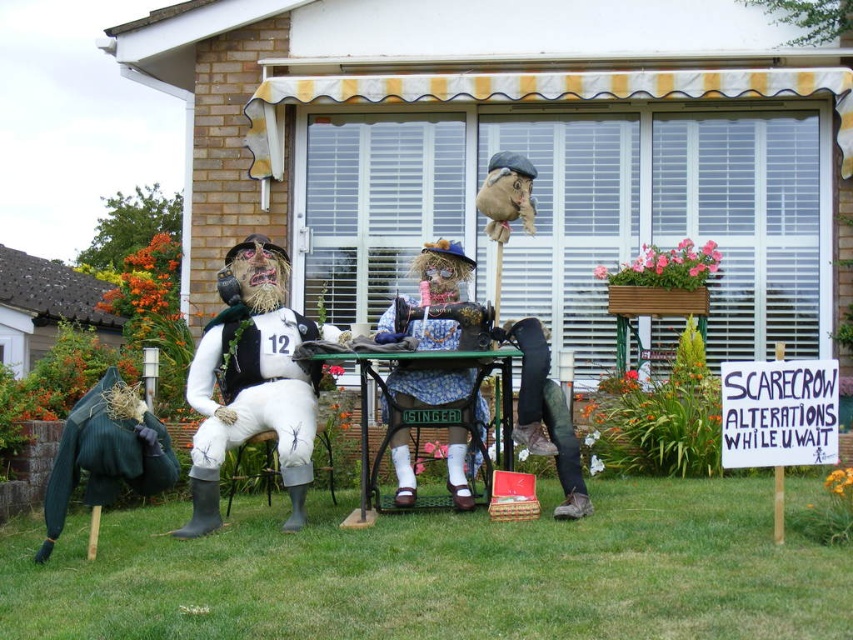
Which of the three scarecrows is positioned at the exact coordinates of point [254,394]?

The white fabric scarecrow at center is positioned at the exact coordinates of point [254,394].

You are a gardener who wants to hang a bird feeder on the highest point between the white fabric scarecrow at center and the blue floral fabric at center. Which object should you choose?

The blue floral fabric at center is taller than the white fabric scarecrow at center, so you should hang the bird feeder on the blue floral fabric at center.

You are standing in the garden and want to place a new scarecrow exactly 10 meters away from your current position. The existing scarecrow on the left is at point (234, 433). Can you place the new scarecrow closer to you than the existing one?

The existing scarecrow on the left at point (234, 433) is 8.39 meters away from you. Since you want to place the new scarecrow exactly 10 meters away, it would be farther than the existing one. Therefore, you cannot place the new scarecrow closer to you than the existing one.